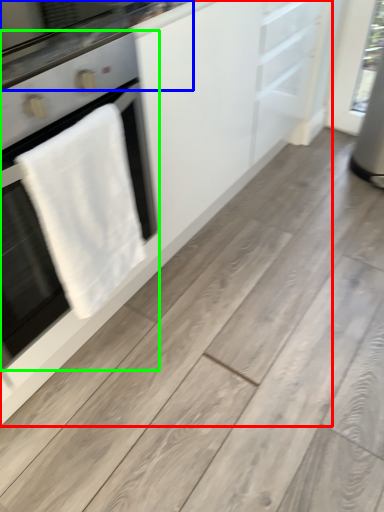
Question: Which is nearer to the cabinetry (highlighted by a red box)? countertop (highlighted by a blue box) or home appliance (highlighted by a green box).

Choices:
 (A) countertop
 (B) home appliance

Answer: (B)